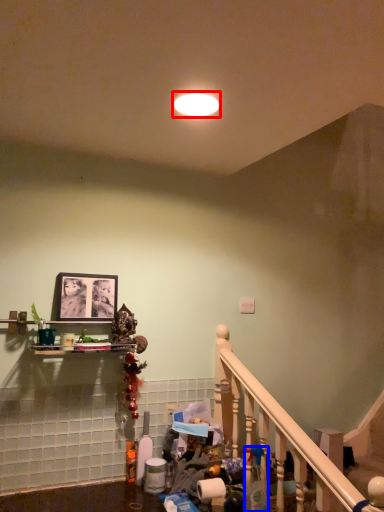
Question: Which object is closer to the camera taking this photo, lighting (highlighted by a red box) or cleaning product (highlighted by a blue box)?

Choices:
 (A) lighting
 (B) cleaning product

Answer: (A)